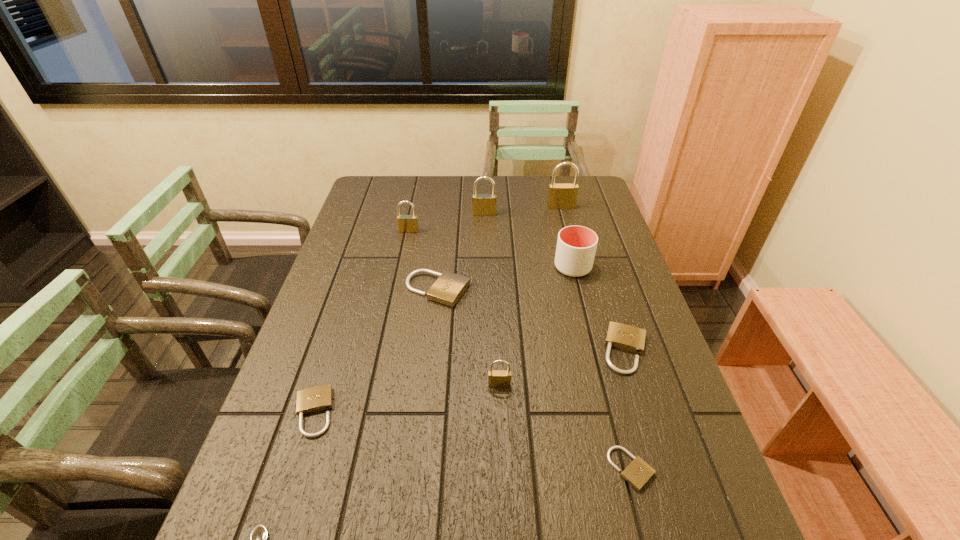
This screenshot has width=960, height=540. In the image, there is a desktop. What are the coordinates of `vacant space at the far edge` in the screenshot? It's located at (499, 186).

The height and width of the screenshot is (540, 960). I want to click on blank area at the left edge, so click(328, 411).

In the image, there is a desktop. Where is `vacant space at the right edge`? vacant space at the right edge is located at coordinates (598, 319).

Find the location of a particular element. This screenshot has height=540, width=960. vacant region at the far left corner of the desktop is located at coordinates (390, 201).

Locate an element on the screen. This screenshot has width=960, height=540. vacant area that lies between the third smallest brass padlock and the third biggest brass padlock is located at coordinates (446, 222).

Find the location of a particular element. The height and width of the screenshot is (540, 960). free space between the tallest padlock and the third smallest beige padlock is located at coordinates (593, 279).

The image size is (960, 540). In order to click on free space between the fifth nearest padlock and the third nearest beige padlock in this screenshot , I will do `click(532, 320)`.

Locate an element on the screen. free spot between the third tallest padlock and the third beige padlock from right to left is located at coordinates coord(423,261).

Locate an element on the screen. vacant area that lies between the nearest brass padlock and the seventh nearest padlock is located at coordinates (492, 299).

Locate an element on the screen. empty location between the cup and the fifth nearest padlock is located at coordinates (505, 279).